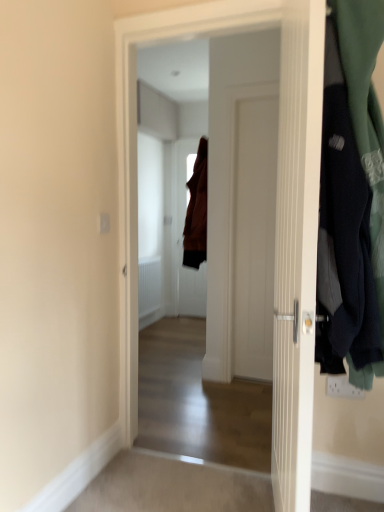
Question: Could you tell me if brown fabric door at center, which appears as the 3th door when viewed from the front, is turned towards white wooden door at center, the 2th door positioned from the back?

Choices:
 (A) no
 (B) yes

Answer: (A)

Question: From the image's perspective, is brown fabric door at center, which appears as the 3th door when viewed from the front, located beneath white wooden door at center, arranged as the second door when viewed from the front?

Choices:
 (A) yes
 (B) no

Answer: (B)

Question: Can you confirm if brown fabric door at center, which ranks as the first door in back-to-front order, is taller than white wooden door at center, the 2th door positioned from the back?

Choices:
 (A) yes
 (B) no

Answer: (B)

Question: From a real-world perspective, is brown fabric door at center, which appears as the 3th door when viewed from the front, under white wooden door at center, the 2th door positioned from the back?

Choices:
 (A) no
 (B) yes

Answer: (B)

Question: Considering the relative positions of brown fabric door at center, which appears as the 3th door when viewed from the front, and white wooden door at center, arranged as the second door when viewed from the front, in the image provided, is brown fabric door at center, which appears as the 3th door when viewed from the front, to the left of white wooden door at center, arranged as the second door when viewed from the front, from the viewer's perspective?

Choices:
 (A) no
 (B) yes

Answer: (B)

Question: From a real-world perspective, is white wooden door at center, arranged as the second door when viewed from the front, physically located above or below dark blue fabric at right?

Choices:
 (A) above
 (B) below

Answer: (B)

Question: Is point (119, 28) positioned closer to the camera than point (345, 150)?

Choices:
 (A) farther
 (B) closer

Answer: (A)

Question: Visually, is white wooden door at center, the 2th door positioned from the back, positioned to the left or to the right of dark blue fabric at right?

Choices:
 (A) left
 (B) right

Answer: (A)

Question: In terms of height, does white wooden door at center, arranged as the second door when viewed from the front, look taller or shorter compared to dark blue fabric at right?

Choices:
 (A) tall
 (B) short

Answer: (A)

Question: From a real-world perspective, is brown fabric door at center, which appears as the 3th door when viewed from the front, positioned above or below dark blue fabric at right?

Choices:
 (A) below
 (B) above

Answer: (A)

Question: Is brown fabric door at center, which ranks as the first door in back-to-front order, in front of or behind dark blue fabric at right in the image?

Choices:
 (A) front
 (B) behind

Answer: (B)

Question: From the image's perspective, is brown fabric door at center, which appears as the 3th door when viewed from the front, positioned above or below dark blue fabric at right?

Choices:
 (A) below
 (B) above

Answer: (B)

Question: Is point (180, 202) positioned closer to the camera than point (347, 273)?

Choices:
 (A) closer
 (B) farther

Answer: (B)

Question: In terms of width, does white wooden door at center, arranged as the second door when viewed from the front, look wider or thinner when compared to white wooden door at center, which appears as the 3th door when viewed from the back?

Choices:
 (A) thin
 (B) wide

Answer: (B)

Question: From the image's perspective, is white wooden door at center, arranged as the second door when viewed from the front, located above or below white wooden door at center, which appears as the 3th door when viewed from the back?

Choices:
 (A) below
 (B) above

Answer: (B)